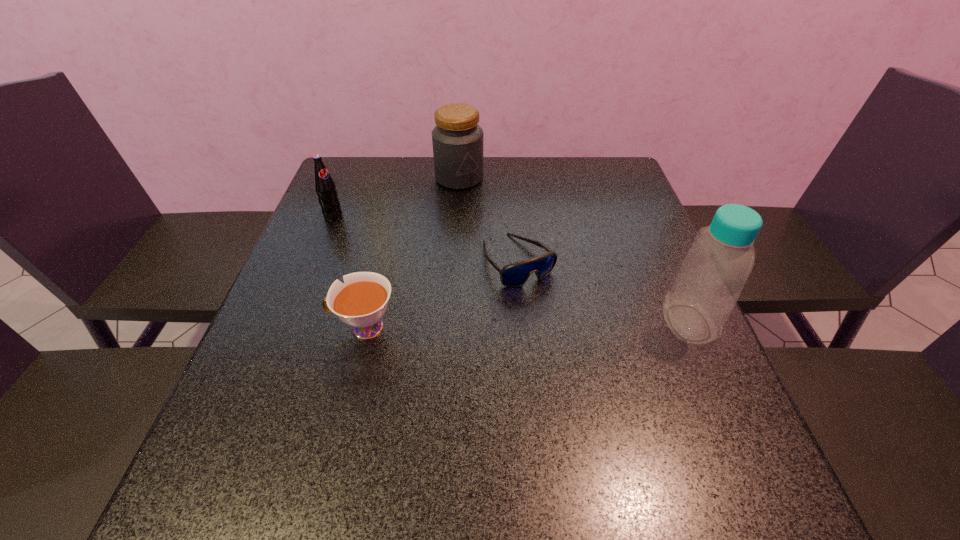
At what (x,y) coordinates should I click in order to perform the action: click on the fourth object from right to left. Please return your answer as a coordinate pair (x, y). The width and height of the screenshot is (960, 540). Looking at the image, I should click on 361,302.

Where is `the fourth tallest object`? The width and height of the screenshot is (960, 540). the fourth tallest object is located at coordinates (361, 302).

Where is `the tallest object`? the tallest object is located at coordinates (712, 275).

I want to click on bottle, so click(x=712, y=275).

The image size is (960, 540). What are the coordinates of `the third shortest object` in the screenshot? It's located at 325,187.

You are a GUI agent. You are given a task and a screenshot of the screen. Output one action in this format:
    pyautogui.click(x=<x>, y=<y>)
    Task: Click on the leftmost object
    
    Given the screenshot: What is the action you would take?
    pyautogui.click(x=325, y=187)

At what (x,y) coordinates should I click in order to perform the action: click on the farthest object. Please return your answer as a coordinate pair (x, y). The image size is (960, 540). Looking at the image, I should click on (457, 139).

The width and height of the screenshot is (960, 540). In order to click on the third farthest object in this screenshot , I will do `click(516, 274)`.

Find the location of a particular element. This screenshot has height=540, width=960. the shortest object is located at coordinates (516, 274).

Where is `vacant space situated on the side of the teacup with the handle`? Image resolution: width=960 pixels, height=540 pixels. vacant space situated on the side of the teacup with the handle is located at coordinates (272, 328).